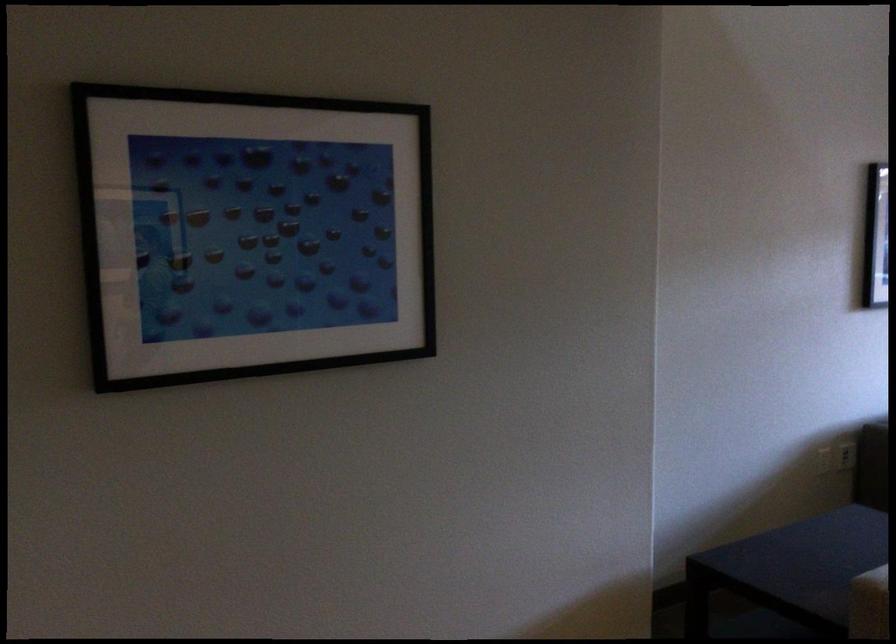
The width and height of the screenshot is (896, 644). What do you see at coordinates (842, 558) in the screenshot? I see `a sofa armrest` at bounding box center [842, 558].